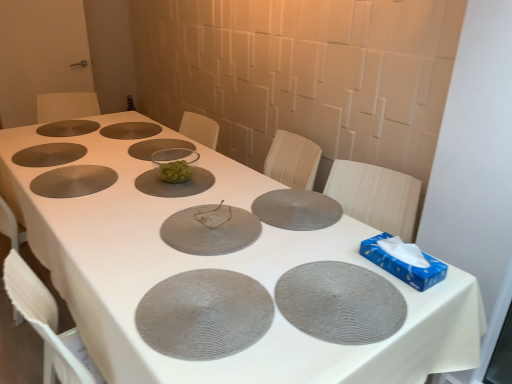
This screenshot has width=512, height=384. Find the location of `free space in front of clear glass bowl at center, marked as the 6th glass plate in a front-to-back arrangement`. free space in front of clear glass bowl at center, marked as the 6th glass plate in a front-to-back arrangement is located at coordinates (139, 204).